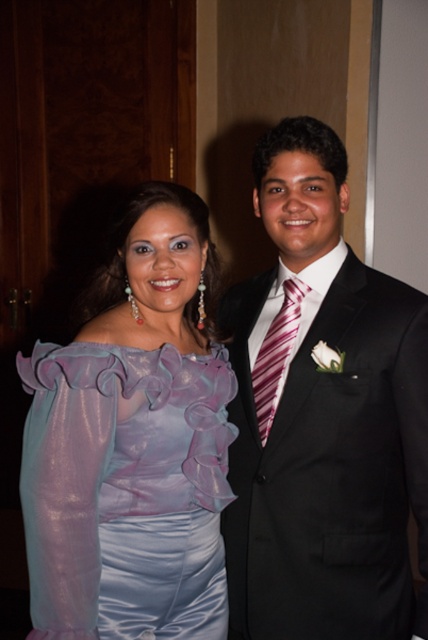
Is shiny black suit at center above striped silk tie at center?

No.

The image size is (428, 640). Find the location of `shiny black suit at center`. shiny black suit at center is located at coordinates (321, 416).

This screenshot has width=428, height=640. I want to click on shiny black suit at center, so click(x=321, y=416).

Does translucent purple blouse at upper left have a larger size compared to striped silk tie at center?

Indeed, translucent purple blouse at upper left has a larger size compared to striped silk tie at center.

Is point (146, 524) farther from camera compared to point (282, 364)?

No, (146, 524) is in front of (282, 364).

Find the location of `translucent purple blouse at upper left`. translucent purple blouse at upper left is located at coordinates (133, 442).

Is shiny black suit at center to the left of translucent purple blouse at upper left from the viewer's perspective?

No, shiny black suit at center is not to the left of translucent purple blouse at upper left.

Does point (222, 320) come closer to viewer compared to point (47, 552)?

No, it is behind (47, 552).

What do you see at coordinates (321, 416) in the screenshot? I see `shiny black suit at center` at bounding box center [321, 416].

The width and height of the screenshot is (428, 640). I want to click on shiny black suit at center, so click(x=321, y=416).